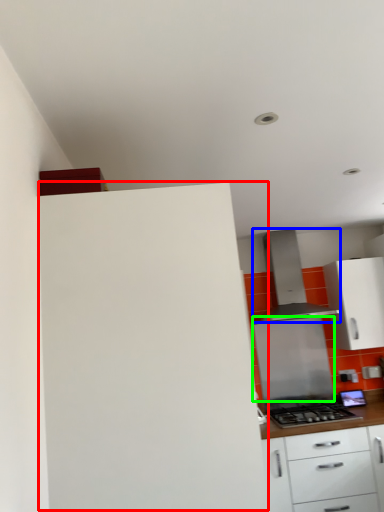
Question: Which is farther away from cabinetry (highlighted by a red box)? kitchen appliance (highlighted by a blue box) or appliance (highlighted by a green box)?

Choices:
 (A) kitchen appliance
 (B) appliance

Answer: (B)